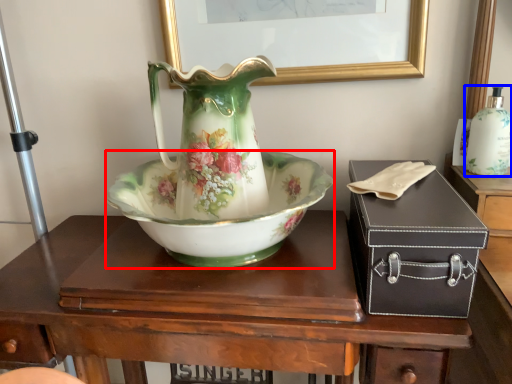
Question: Which of the following is the farthest to the observer, bowl (highlighted by a red box) or bottle (highlighted by a blue box)?

Choices:
 (A) bowl
 (B) bottle

Answer: (B)